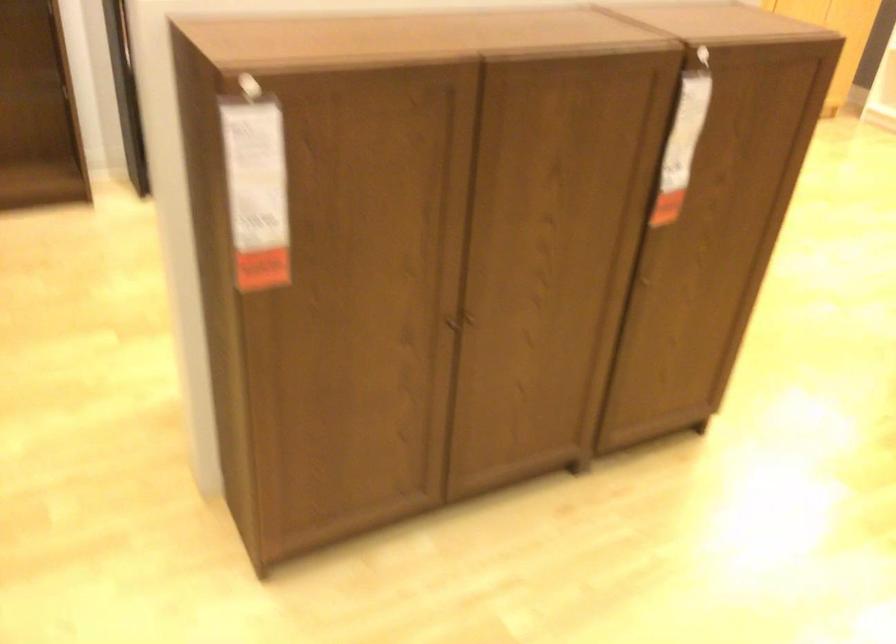
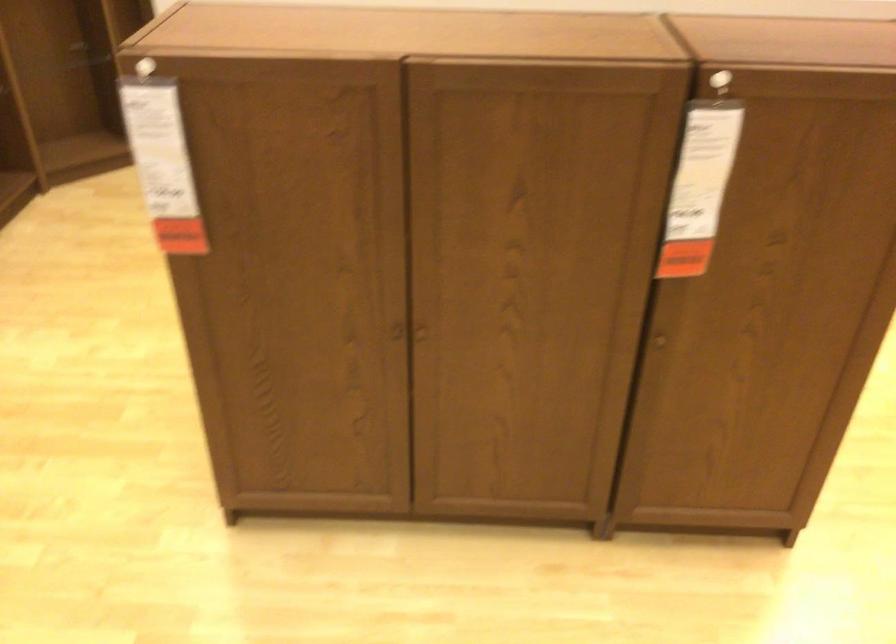
Find the pixel in the second image that matches point 228,93 in the first image.

(143, 67)